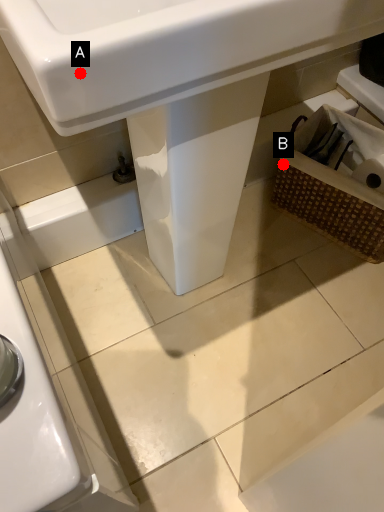
Question: Two points are circled on the image, labeled by A and B beside each circle. Among these points, which one is nearest to the camera?

Choices:
 (A) A is closer
 (B) B is closer

Answer: (A)